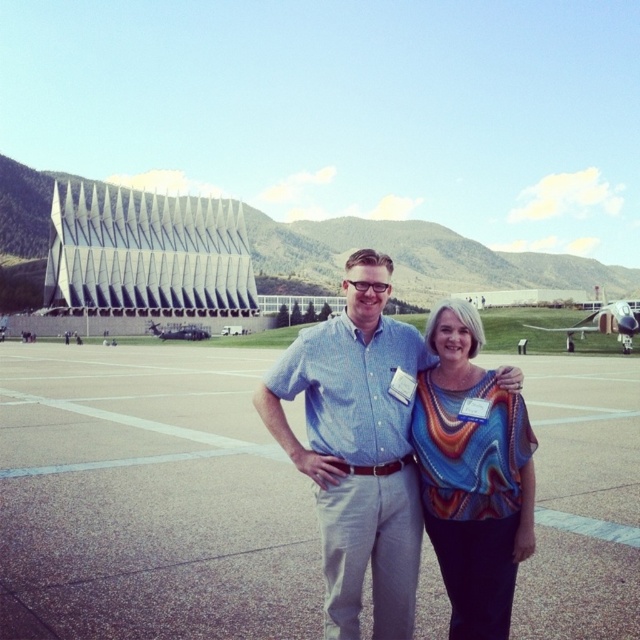
Measure the distance between blue cotton shirt at center and camera.

11.12 meters

This screenshot has height=640, width=640. Describe the element at coordinates (356, 449) in the screenshot. I see `blue cotton shirt at center` at that location.

Between point (336, 358) and point (502, 408), which one is positioned in front?

Point (502, 408) is in front.

Locate an element on the screen. blue cotton shirt at center is located at coordinates (356, 449).

Does concrete tarmac at center appear over multicolored woven blouse at center?

Actually, concrete tarmac at center is below multicolored woven blouse at center.

Who is taller, concrete tarmac at center or multicolored woven blouse at center?

multicolored woven blouse at center is taller.

Is point (104, 577) more distant than point (440, 330)?

Yes, point (104, 577) is behind point (440, 330).

Image resolution: width=640 pixels, height=640 pixels. Identify the location of concrete tarmac at center. (148, 499).

Between concrete tarmac at center and blue cotton shirt at center, which one appears on the right side from the viewer's perspective?

Positioned to the right is blue cotton shirt at center.

Does point (525, 600) lie in front of point (358, 282)?

Yes, point (525, 600) is closer to viewer.

You are a GUI agent. You are given a task and a screenshot of the screen. Output one action in this format:
    pyautogui.click(x=<x>, y=<y>)
    Task: Click on the concrete tarmac at center
    The width and height of the screenshot is (640, 640).
    Given the screenshot: What is the action you would take?
    pyautogui.click(x=148, y=499)